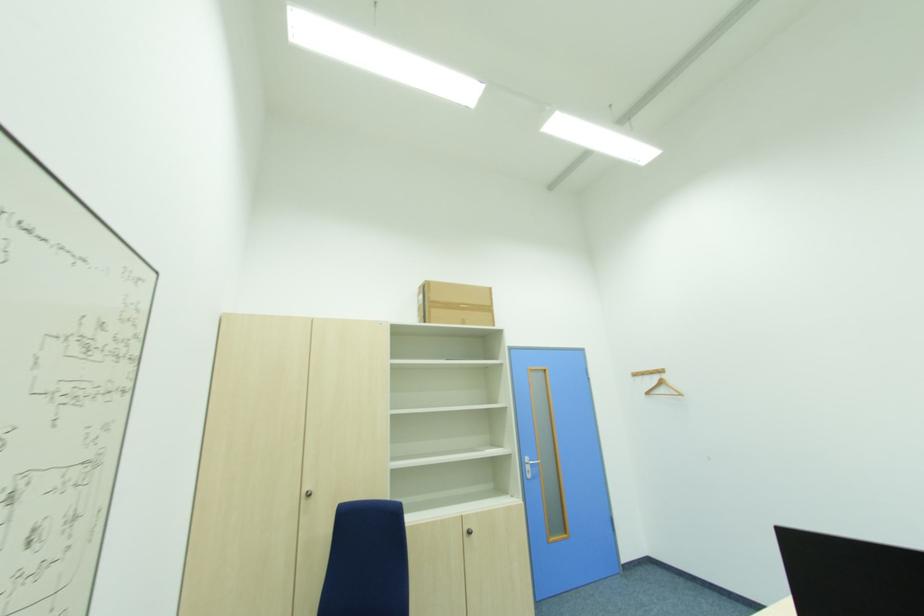
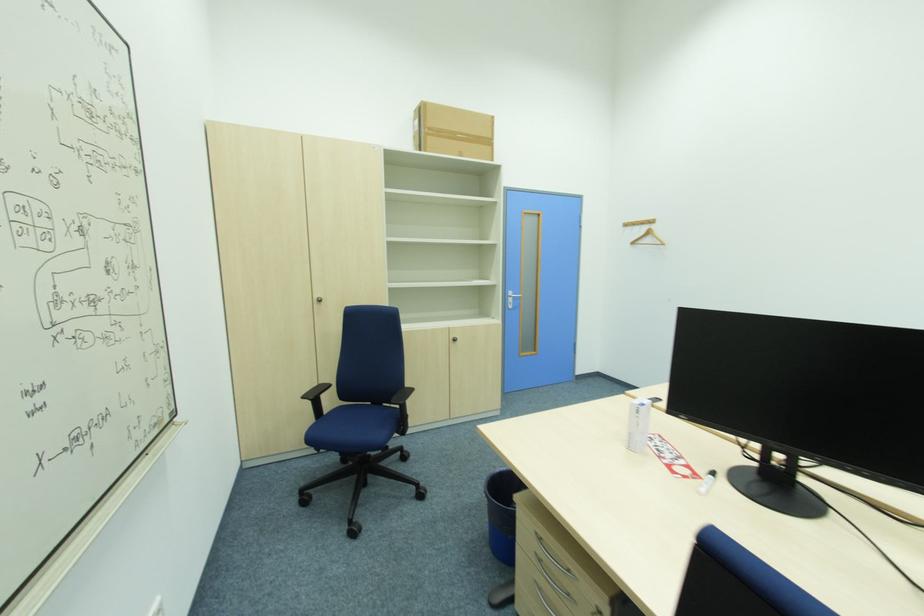
The images are taken continuously from a first-person perspective. In which direction are you moving?

The cameraman walked toward right, backward.